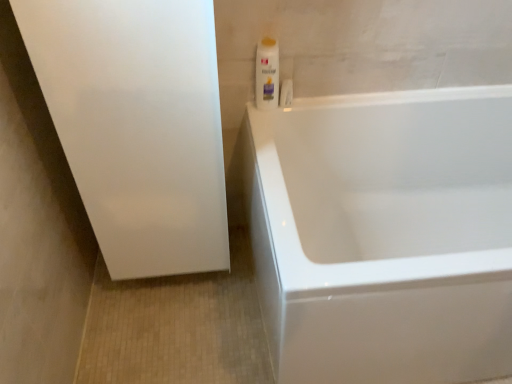
Question: From a real-world perspective, is white plastic bottle at upper right beneath white matte screen door at left?

Choices:
 (A) no
 (B) yes

Answer: (A)

Question: Is white plastic bottle at upper right behind white matte screen door at left?

Choices:
 (A) no
 (B) yes

Answer: (B)

Question: Are white plastic bottle at upper right and white matte screen door at left beside each other?

Choices:
 (A) yes
 (B) no

Answer: (B)

Question: Does white plastic bottle at upper right have a larger size compared to white matte screen door at left?

Choices:
 (A) yes
 (B) no

Answer: (B)

Question: Considering the relative sizes of white plastic bottle at upper right and white matte screen door at left in the image provided, is white plastic bottle at upper right thinner than white matte screen door at left?

Choices:
 (A) no
 (B) yes

Answer: (B)

Question: From the image's perspective, is white matte screen door at left above or below white glossy bathtub at right?

Choices:
 (A) below
 (B) above

Answer: (B)

Question: Is white matte screen door at left wider or thinner than white glossy bathtub at right?

Choices:
 (A) thin
 (B) wide

Answer: (A)

Question: Based on their sizes in the image, would you say white matte screen door at left is bigger or smaller than white glossy bathtub at right?

Choices:
 (A) small
 (B) big

Answer: (A)

Question: In the image, is white matte screen door at left on the left side or the right side of white glossy bathtub at right?

Choices:
 (A) right
 (B) left

Answer: (B)

Question: Is point (160, 218) positioned closer to the camera than point (274, 74)?

Choices:
 (A) farther
 (B) closer

Answer: (B)

Question: Is white matte screen door at left taller or shorter than white plastic bottle at upper right?

Choices:
 (A) tall
 (B) short

Answer: (A)

Question: From the image's perspective, relative to white plastic bottle at upper right, is white matte screen door at left above or below?

Choices:
 (A) above
 (B) below

Answer: (B)

Question: In the image, is white matte screen door at left on the left side or the right side of white plastic bottle at upper right?

Choices:
 (A) right
 (B) left

Answer: (B)

Question: From the image's perspective, relative to white glossy bathtub at right, is white plastic bottle at upper right above or below?

Choices:
 (A) above
 (B) below

Answer: (A)

Question: From a real-world perspective, relative to white glossy bathtub at right, is white plastic bottle at upper right vertically above or below?

Choices:
 (A) above
 (B) below

Answer: (A)